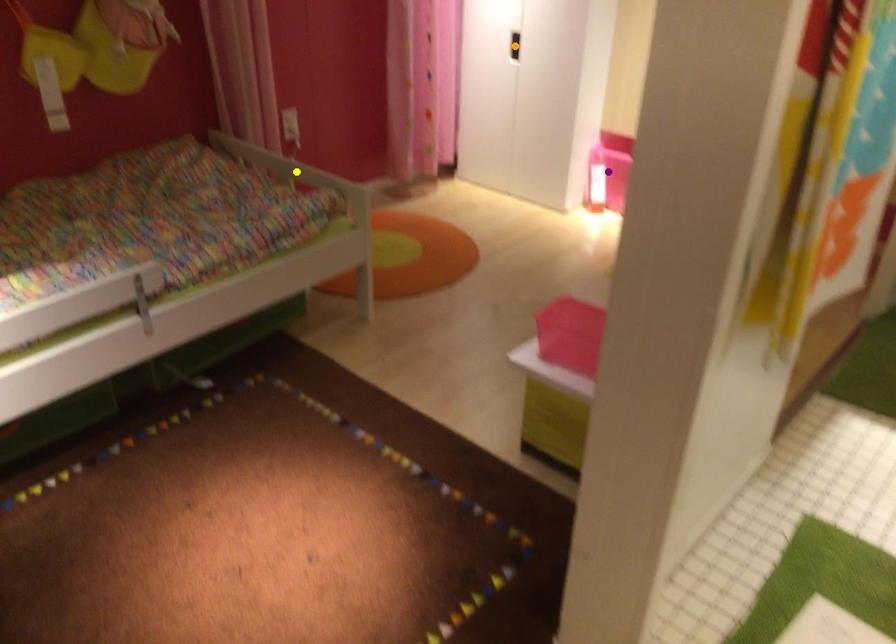
Order these from nearest to farthest:
A) orange point
B) purple point
C) yellow point

A: purple point
yellow point
orange point